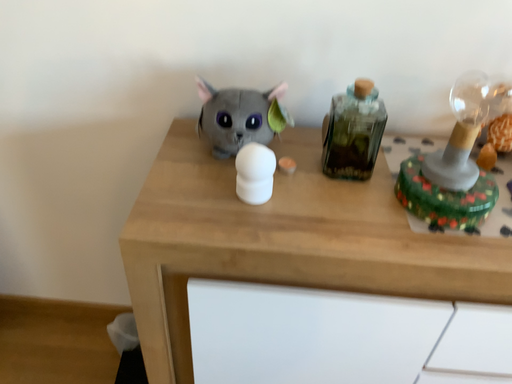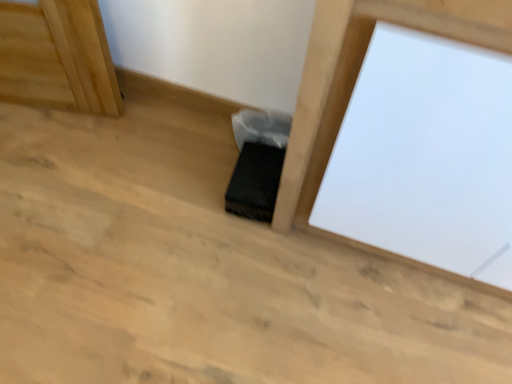
Question: Which way did the camera rotate in the video?

Choices:
 (A) rotated downward
 (B) rotated upward

Answer: (A)